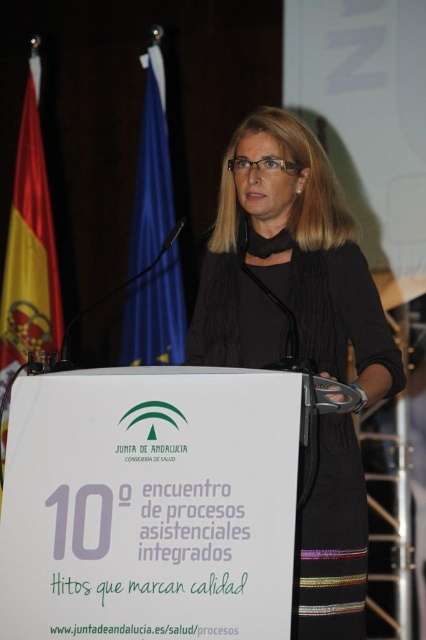
Which is behind, point (154, 324) or point (13, 308)?

The point (13, 308) is behind.

Can you confirm if blue fabric flag at upper left is positioned above red fabric flag at left?

Yes.

Where is `blue fabric flag at upper left`? blue fabric flag at upper left is located at coordinates (154, 237).

Can you confirm if black matte dress at center is positioned to the right of red fabric flag at left?

Yes, black matte dress at center is to the right of red fabric flag at left.

In the scene shown: Does black matte dress at center have a larger size compared to red fabric flag at left?

Correct, black matte dress at center is larger in size than red fabric flag at left.

Is point (351, 515) positioned after point (5, 380)?

That is False.

Identify the location of black matte dress at center. This screenshot has width=426, height=640. (288, 268).

Describe the element at coordinates (288, 268) in the screenshot. I see `black matte dress at center` at that location.

The image size is (426, 640). I want to click on black matte dress at center, so click(288, 268).